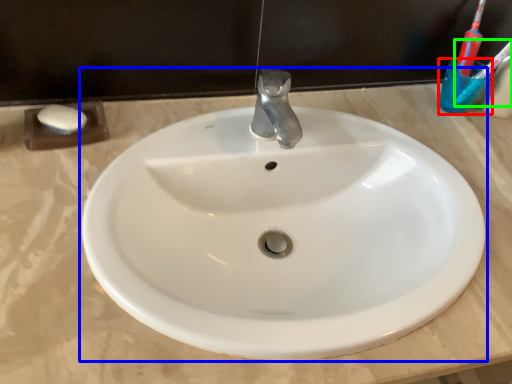
Question: Estimate the real-world distances between objects in this image. Which object is closer to liquid (highlighted by a red box), sink (highlighted by a blue box) or toothbrush (highlighted by a green box)?

Choices:
 (A) sink
 (B) toothbrush

Answer: (B)